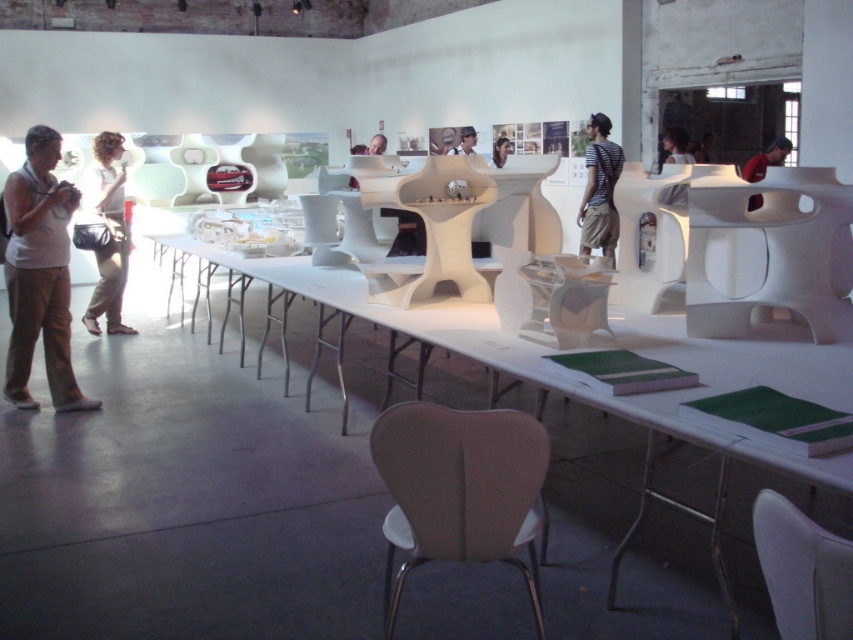
You are an interior designer observing the exhibition space. You notice the matte black hair at upper center and the matte black shirt at center. Which object would you say occupies a bigger area in the scene?

The matte black hair at upper center has a larger size compared to the matte black shirt at center, so it occupies a bigger area in the scene.